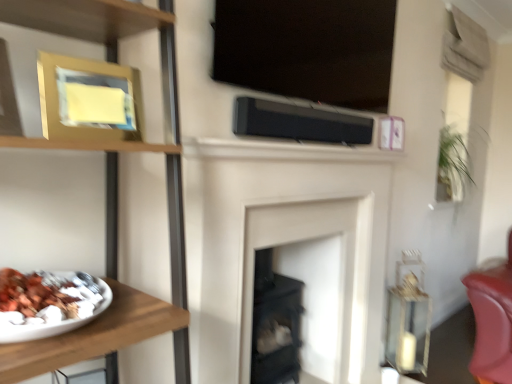
Question: Considering the positions of wooden plate at left and white matte fireplace at center in the image, is wooden plate at left bigger or smaller than white matte fireplace at center?

Choices:
 (A) big
 (B) small

Answer: (A)

Question: In the image, is wooden plate at left on the left side or the right side of white matte fireplace at center?

Choices:
 (A) right
 (B) left

Answer: (B)

Question: Considering the real-world distances, which object is closest to the black matte speaker at center?

Choices:
 (A) white matte plate at left
 (B) gold metallic picture frame at upper left
 (C) white matte fireplace at center
 (D) wooden plate at left

Answer: (C)

Question: Which of these objects is positioned closest to the wooden plate at left?

Choices:
 (A) white matte plate at left
 (B) gold metallic picture frame at upper left
 (C) black matte speaker at center
 (D) white matte fireplace at center

Answer: (B)